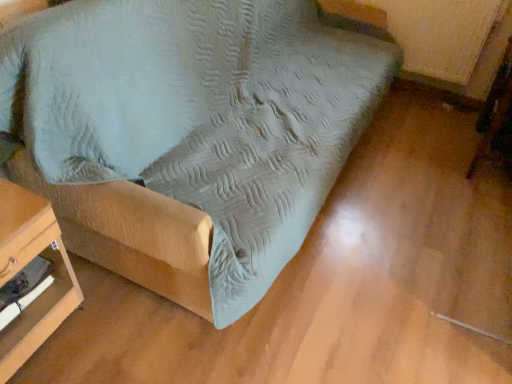
Question: Should I look upward or downward to see wooden table at lower left, which ranks as the first furniture in left-to-right order?

Choices:
 (A) down
 (B) up

Answer: (A)

Question: Considering the relative sizes of suede-like fabric couch at center, placed as the 1th furniture when sorted from right to left, and wooden swivel chair at lower right in the image provided, is suede-like fabric couch at center, placed as the 1th furniture when sorted from right to left, smaller than wooden swivel chair at lower right?

Choices:
 (A) yes
 (B) no

Answer: (B)

Question: Considering the relative sizes of suede-like fabric couch at center, placed as the 1th furniture when sorted from right to left, and wooden swivel chair at lower right in the image provided, is suede-like fabric couch at center, placed as the 1th furniture when sorted from right to left, shorter than wooden swivel chair at lower right?

Choices:
 (A) yes
 (B) no

Answer: (B)

Question: Is suede-like fabric couch at center, placed as the 1th furniture when sorted from right to left, not close to wooden swivel chair at lower right?

Choices:
 (A) yes
 (B) no

Answer: (A)

Question: Does suede-like fabric couch at center, placed as the 1th furniture when sorted from right to left, have a greater width compared to wooden swivel chair at lower right?

Choices:
 (A) no
 (B) yes

Answer: (B)

Question: Is suede-like fabric couch at center, the 2th furniture when ordered from left to right, in contact with wooden swivel chair at lower right?

Choices:
 (A) no
 (B) yes

Answer: (A)

Question: Is suede-like fabric couch at center, the 2th furniture when ordered from left to right, to the right of wooden swivel chair at lower right from the viewer's perspective?

Choices:
 (A) yes
 (B) no

Answer: (B)

Question: Is suede-like fabric couch at center, placed as the 1th furniture when sorted from right to left, inside wooden table at lower left, which ranks as the first furniture in left-to-right order?

Choices:
 (A) no
 (B) yes

Answer: (A)

Question: From a real-world perspective, is wooden table at lower left, which ranks as the first furniture in left-to-right order, beneath suede-like fabric couch at center, placed as the 1th furniture when sorted from right to left?

Choices:
 (A) no
 (B) yes

Answer: (B)

Question: Is wooden table at lower left, which ranks as the first furniture in left-to-right order, shorter than suede-like fabric couch at center, placed as the 1th furniture when sorted from right to left?

Choices:
 (A) no
 (B) yes

Answer: (B)

Question: From a real-world perspective, is wooden table at lower left, which ranks as the first furniture in left-to-right order, on suede-like fabric couch at center, placed as the 1th furniture when sorted from right to left?

Choices:
 (A) yes
 (B) no

Answer: (B)

Question: Is wooden table at lower left, the 2th furniture when ordered from right to left, to the left of suede-like fabric couch at center, the 2th furniture when ordered from left to right, from the viewer's perspective?

Choices:
 (A) no
 (B) yes

Answer: (B)

Question: Would you say wooden table at lower left, the 2th furniture when ordered from right to left, is a long distance from suede-like fabric couch at center, the 2th furniture when ordered from left to right?

Choices:
 (A) no
 (B) yes

Answer: (A)

Question: Are suede-like fabric couch at center, the 2th furniture when ordered from left to right, and wooden table at lower left, the 2th furniture when ordered from right to left, far apart?

Choices:
 (A) no
 (B) yes

Answer: (A)